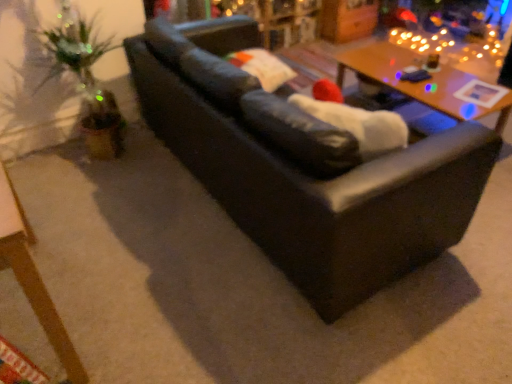
Question: From the image's perspective, is matte black couch at center below wooden table at lower left, the 1th table positioned from the front?

Choices:
 (A) no
 (B) yes

Answer: (A)

Question: Can you confirm if matte black couch at center is bigger than wooden table at lower left, acting as the second table starting from the back?

Choices:
 (A) yes
 (B) no

Answer: (A)

Question: Can you confirm if matte black couch at center is smaller than wooden table at lower left, acting as the second table starting from the back?

Choices:
 (A) no
 (B) yes

Answer: (A)

Question: Considering the relative positions of matte black couch at center and wooden table at lower left, acting as the second table starting from the back, in the image provided, is matte black couch at center to the left of wooden table at lower left, acting as the second table starting from the back, from the viewer's perspective?

Choices:
 (A) yes
 (B) no

Answer: (B)

Question: Does matte black couch at center contain wooden table at lower left, the 2th table in the right-to-left sequence?

Choices:
 (A) yes
 (B) no

Answer: (B)

Question: Looking at the image, does wooden table at lower left, the 1th table positioned from the front, seem bigger or smaller compared to matte black couch at center?

Choices:
 (A) big
 (B) small

Answer: (B)

Question: From a real-world perspective, relative to matte black couch at center, is wooden table at lower left, the 2th table in the right-to-left sequence, vertically above or below?

Choices:
 (A) below
 (B) above

Answer: (A)

Question: Considering the positions of wooden table at lower left, the 2th table in the right-to-left sequence, and matte black couch at center in the image, is wooden table at lower left, the 2th table in the right-to-left sequence, wider or thinner than matte black couch at center?

Choices:
 (A) wide
 (B) thin

Answer: (B)

Question: Do you think wooden table at lower left, the 1th table positioned from the front, is within matte black couch at center, or outside of it?

Choices:
 (A) inside
 (B) outside

Answer: (B)

Question: From the image's perspective, is matte black couch at center positioned above or below wooden table at lower left, the first table in the left-to-right sequence?

Choices:
 (A) above
 (B) below

Answer: (A)

Question: Looking at the image, does matte black couch at center seem bigger or smaller compared to wooden table at lower left, the 2th table in the right-to-left sequence?

Choices:
 (A) small
 (B) big

Answer: (B)

Question: Relative to wooden table at lower left, the 2th table in the right-to-left sequence, is matte black couch at center in front or behind?

Choices:
 (A) front
 (B) behind

Answer: (B)

Question: Is matte black couch at center situated inside wooden table at lower left, the 2th table in the right-to-left sequence, or outside?

Choices:
 (A) outside
 (B) inside

Answer: (A)

Question: Would you say wooden table at upper right, acting as the second table starting from the left, is inside or outside matte black couch at center?

Choices:
 (A) inside
 (B) outside

Answer: (B)

Question: Does point (468, 77) appear closer or farther from the camera than point (291, 198)?

Choices:
 (A) farther
 (B) closer

Answer: (A)